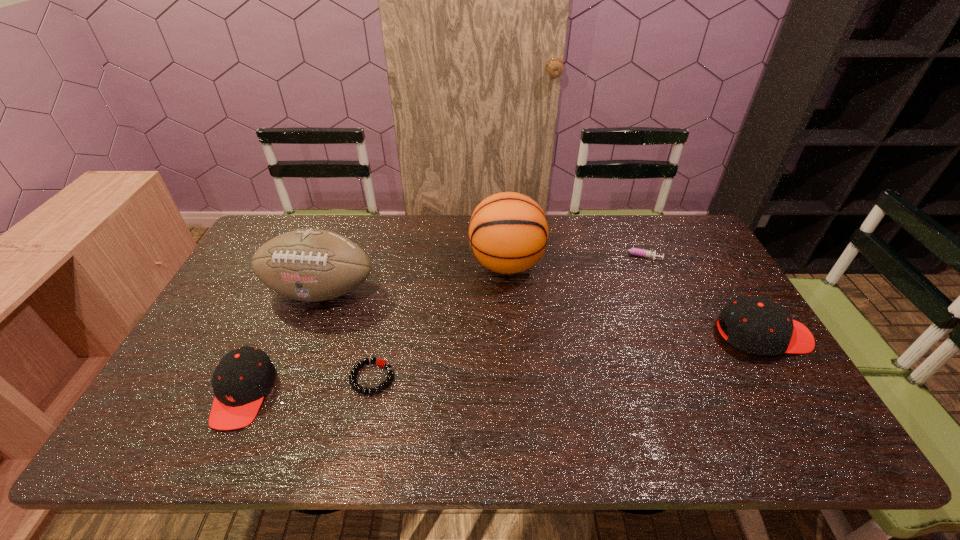
The image size is (960, 540). I want to click on vacant space that is in between the rightmost object and the shortest object, so click(567, 356).

Where is `free space between the syringe and the nearer cap`? free space between the syringe and the nearer cap is located at coordinates (440, 325).

At what (x,y) coordinates should I click in order to perform the action: click on vacant region between the right cap and the nearer cap. Please return your answer as a coordinate pair (x, y). This screenshot has height=540, width=960. Looking at the image, I should click on (503, 364).

Where is `empty space between the nearer cap and the second tallest object`? The height and width of the screenshot is (540, 960). empty space between the nearer cap and the second tallest object is located at coordinates point(282,342).

Locate an element on the screen. Image resolution: width=960 pixels, height=540 pixels. vacant area between the rightmost object and the third object from right to left is located at coordinates (x=635, y=299).

Image resolution: width=960 pixels, height=540 pixels. I want to click on free spot between the shortest object and the third shortest object, so click(x=308, y=386).

You are a GUI agent. You are given a task and a screenshot of the screen. Output one action in this format:
    pyautogui.click(x=<x>, y=<y>)
    Task: Click on the free space between the farther cap and the fifth object from left to right
    
    Given the screenshot: What is the action you would take?
    pyautogui.click(x=700, y=295)

Identify which object is the second closest to the rightmost object. Please provide its 2D coordinates. Your answer should be formatted as a tuple, i.e. [(x, y)], where the tuple contains the x and y coordinates of a point satisfying the conditions above.

[(508, 232)]

Find the location of `object that is the third nearest to the third object from right to left`. object that is the third nearest to the third object from right to left is located at coordinates (380, 362).